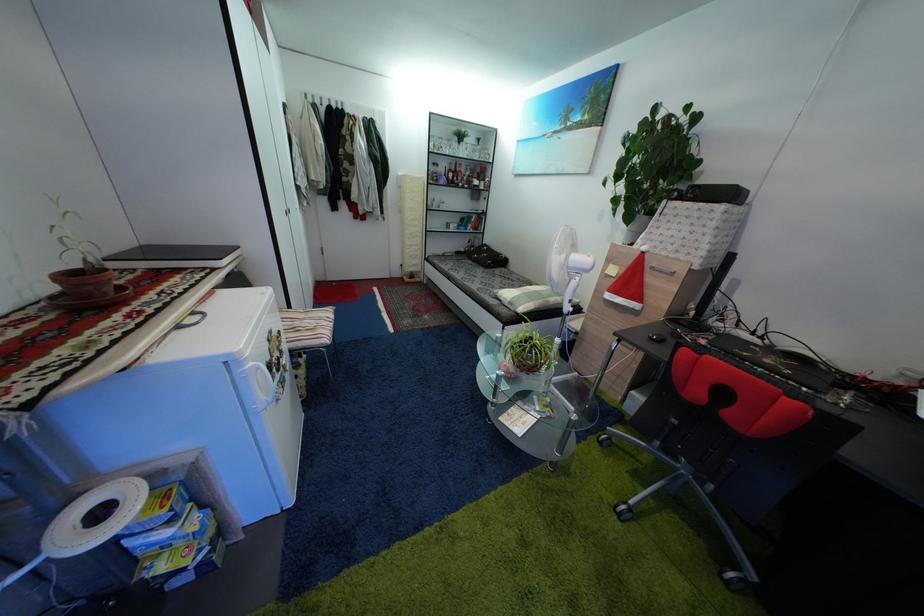
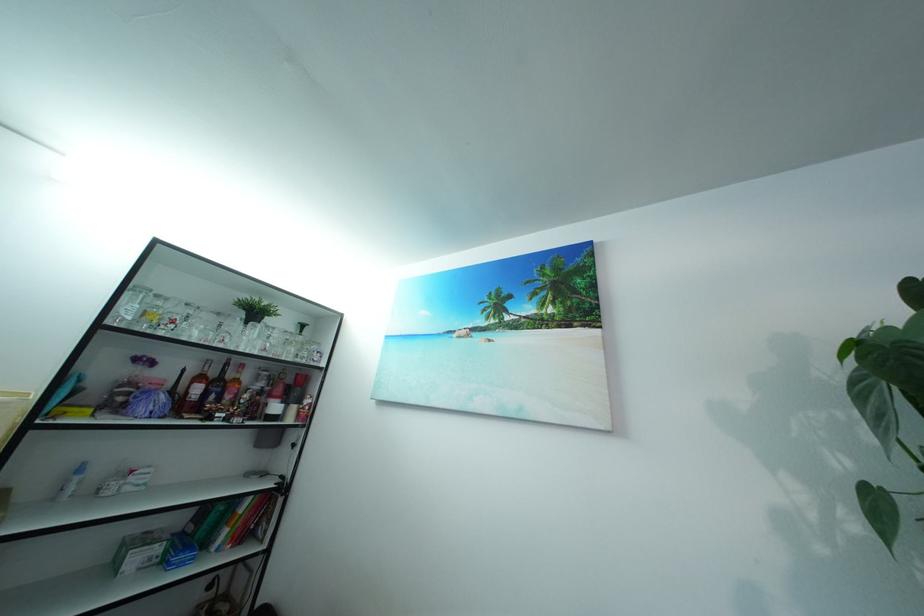
Locate, in the second image, the point that corresponds to point 478,184 in the first image.

(269, 400)